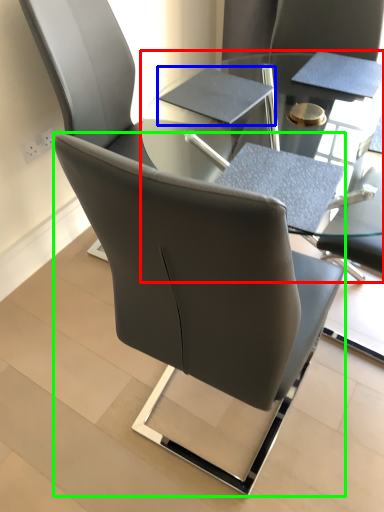
Question: Which is farther away from table (highlighted by a red box)? notebook (highlighted by a blue box) or chair (highlighted by a green box)?

Choices:
 (A) notebook
 (B) chair

Answer: (B)